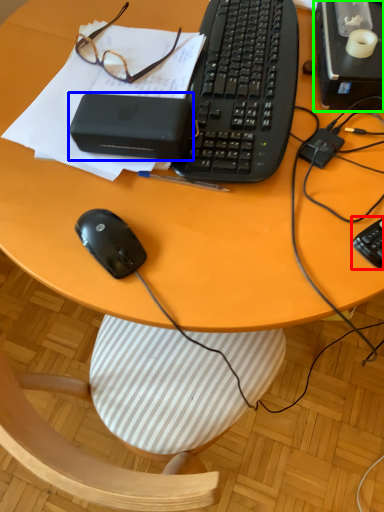
Question: Considering the real-world distances, which object is farthest from computer keyboard (highlighted by a red box)? gadget (highlighted by a blue box) or desktop computer (highlighted by a green box)?

Choices:
 (A) gadget
 (B) desktop computer

Answer: (A)